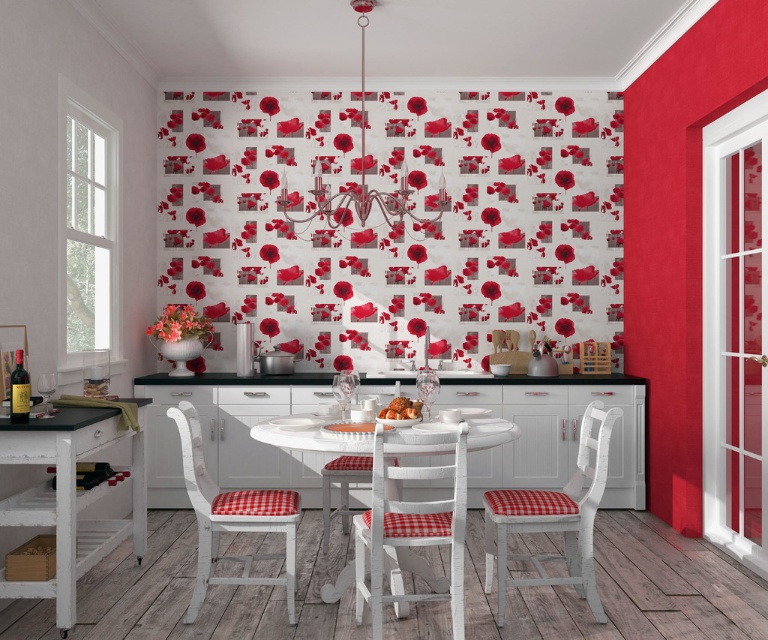
Based on the photo, you are a guest entering the dining area and see the white painted wood chair with red checkered cushion at lower left and the white checkered chair at center. Which chair is closer to you?

The white painted wood chair with red checkered cushion at lower left is closer to you because it is positioned over the white checkered chair at center, meaning it is in front and nearer to your viewpoint.

You are planning to seat guests at the dining table. You have two chairs available for placement. The chairs are the white painted wood chair with red checkered cushion at lower left and the white checkered chair at center. Which chair requires more space to place along the table edge?

The white painted wood chair with red checkered cushion at lower left requires more space because its width is larger than the white checkered chair at center.

You are planning to rearrange the dining area and want to place a large rectangular plant stand between the white wood table at left and the white checkered chair at center. Given that the plant stand is 1.2 meters wide, can it fit in the space between them?

The white wood table at left is bigger than the white checkered chair at center, but the exact distance between them isn generated in the provided information. Therefore, it is impossible to determine if the plant stand will fit without additional measurements.